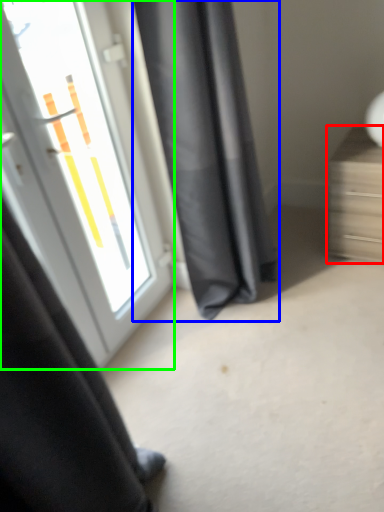
Question: Based on their relative distances, which object is nearer to furniture (highlighted by a red box)? Choose from curtain (highlighted by a blue box) and door (highlighted by a green box).

Choices:
 (A) curtain
 (B) door

Answer: (A)